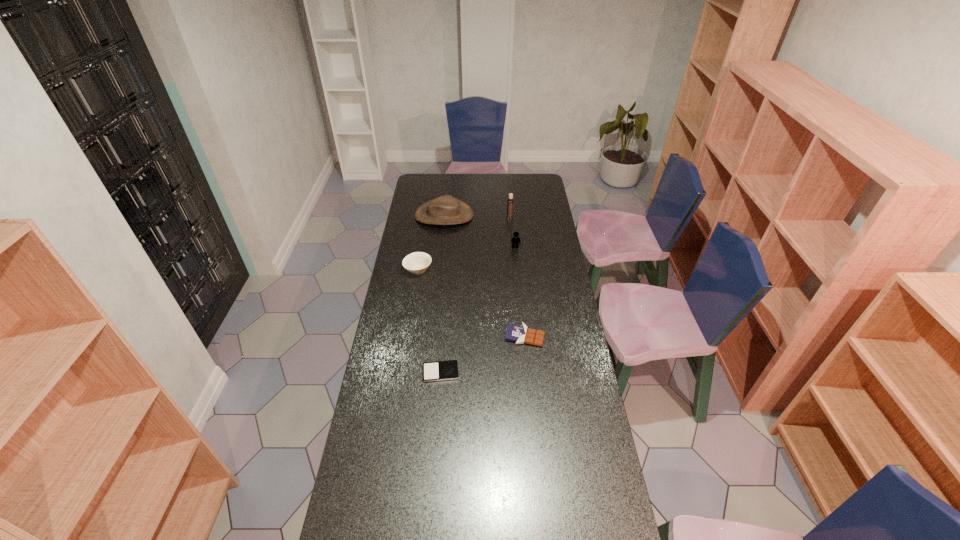
You are a GUI agent. You are given a task and a screenshot of the screen. Output one action in this format:
    pyautogui.click(x=<x>, y=<y>)
    Task: Click on the vacant space at the right edge of the desktop
    The image size is (960, 540).
    Given the screenshot: What is the action you would take?
    pyautogui.click(x=622, y=537)

Locate an element on the screen. This screenshot has height=540, width=960. vacant space at the far left corner of the desktop is located at coordinates (414, 191).

Where is `blank region between the bowl and the cowboy hat`? The height and width of the screenshot is (540, 960). blank region between the bowl and the cowboy hat is located at coordinates (431, 242).

I want to click on free space that is in between the third farthest object and the chocolate bar, so 520,292.

Locate an element on the screen. vacant area that lies between the cowboy hat and the second nearest object is located at coordinates (485, 276).

You are a GUI agent. You are given a task and a screenshot of the screen. Output one action in this format:
    pyautogui.click(x=<x>, y=<y>)
    Task: Click on the free space between the candle holder and the Lego
    The image size is (960, 540).
    Given the screenshot: What is the action you would take?
    (x=513, y=232)

Locate an element on the screen. vacant space that's between the tallest object and the fourth farthest object is located at coordinates (464, 244).

At what (x,y) coordinates should I click in order to perform the action: click on free point between the tallest object and the third nearest object. Please return your answer as a coordinate pair (x, y). This screenshot has height=540, width=960. Looking at the image, I should click on (464, 244).

You are a GUI agent. You are given a task and a screenshot of the screen. Output one action in this format:
    pyautogui.click(x=<x>, y=<y>)
    Task: Click on the free point between the Lego and the iPod
    
    Given the screenshot: What is the action you would take?
    pyautogui.click(x=478, y=310)

I want to click on empty location between the fourth tallest object and the Lego, so click(467, 259).